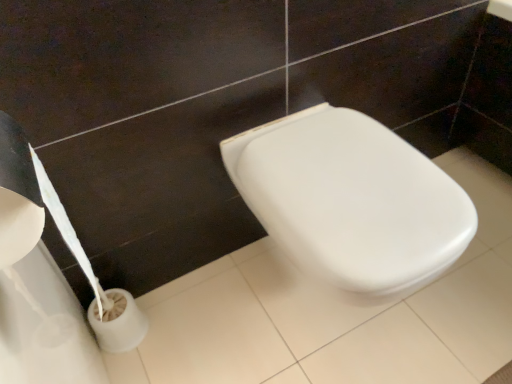
This screenshot has width=512, height=384. I want to click on vacant area on top of white glossy toilet at center (from a real-world perspective), so click(349, 168).